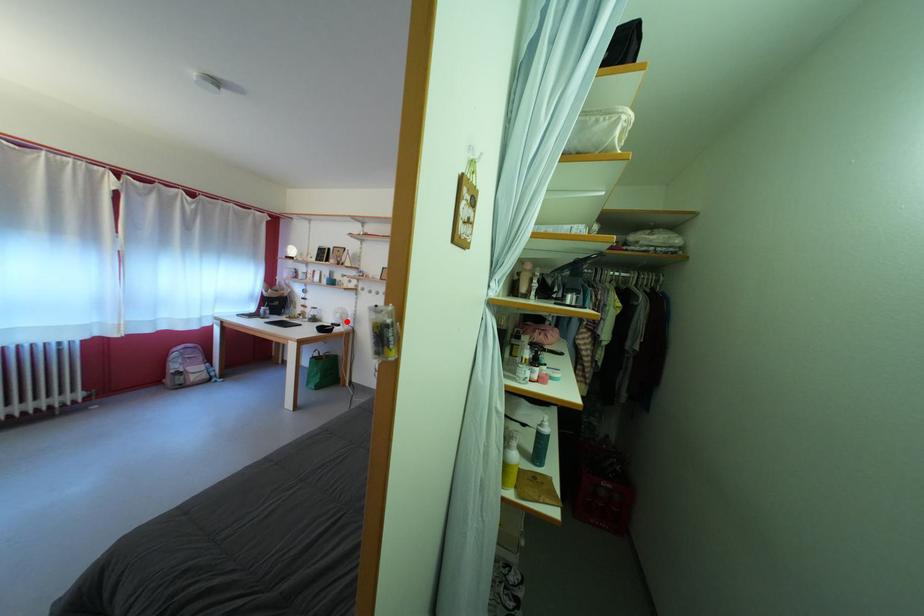
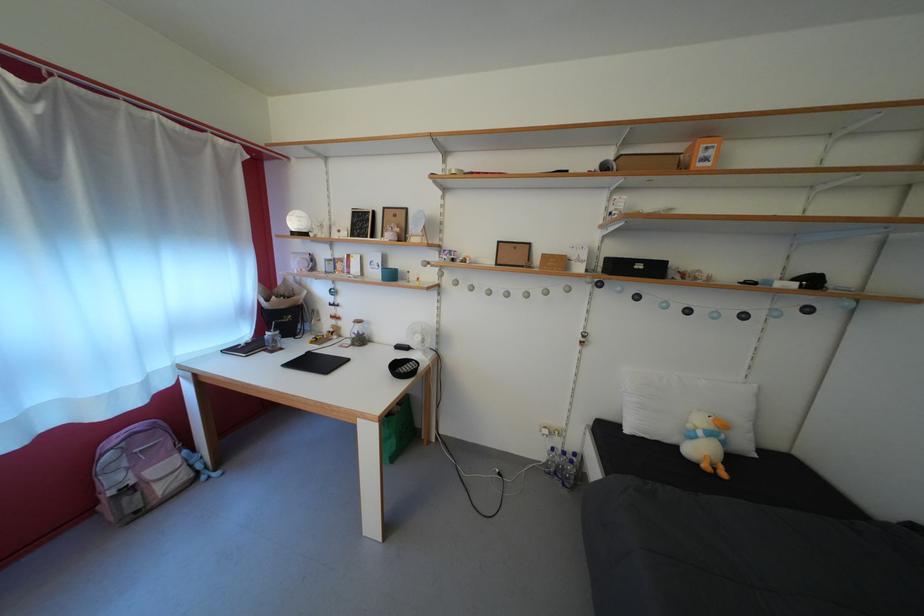
Question: I am providing you with two images of the same scene from different viewpoints. Image1 has a red point marked. In image2, the corresponding 3D location appears at what relative position? Reply with the corresponding letter.

Choices:
 (A) Closer
 (B) Farther

Answer: (A)